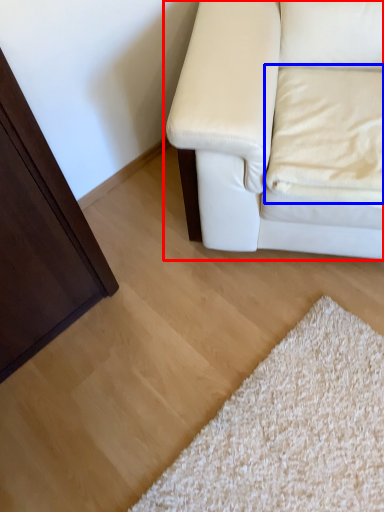
Question: Which of the following is the closest to the observer, studio couch (highlighted by a red box) or pillow (highlighted by a blue box)?

Choices:
 (A) studio couch
 (B) pillow

Answer: (A)